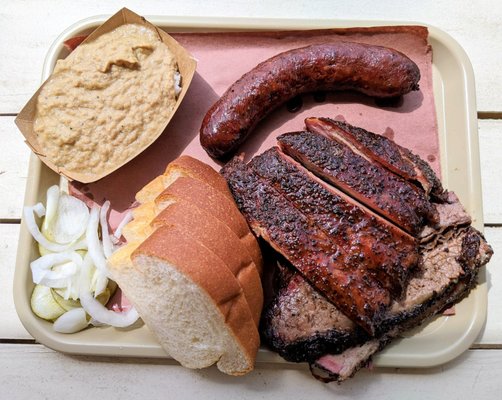
You are a GUI agent. You are given a task and a screenshot of the screen. Output one action in this format:
    pyautogui.click(x=<x>, y=<y>)
    Task: Click on the tray
    The width and height of the screenshot is (502, 400).
    Given the screenshot: What is the action you would take?
    pyautogui.click(x=456, y=124)